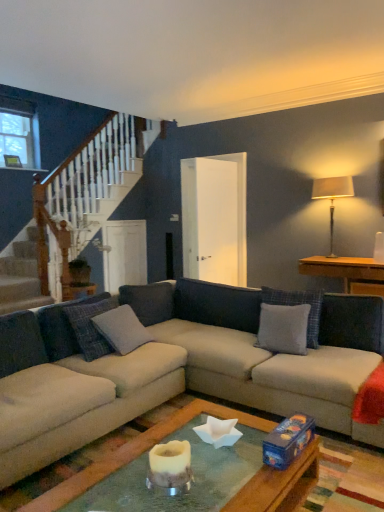
What is the approximate height of wooden side table at right?

16.51 inches.

How much space does gray fabric pillow at center, which ranks as the first pillow in left-to-right order, occupy horizontally?

gray fabric pillow at center, which ranks as the first pillow in left-to-right order, is 5.11 inches in width.

I want to click on clear glass window at upper left, so click(19, 134).

Image resolution: width=384 pixels, height=512 pixels. Describe the element at coordinates (19, 134) in the screenshot. I see `clear glass window at upper left` at that location.

What do you see at coordinates (149, 301) in the screenshot?
I see `gray fabric pillow at center, which is counted as the 2th pillow, starting from the left` at bounding box center [149, 301].

This screenshot has height=512, width=384. Find the location of `gray fabric pillow at center, which is counted as the 2th pillow, starting from the left`. gray fabric pillow at center, which is counted as the 2th pillow, starting from the left is located at coordinates (149, 301).

At what (x,y) coordinates should I click in order to perform the action: click on beige fabric couch at center. Please return your answer as a coordinate pair (x, y). This screenshot has height=512, width=384. Looking at the image, I should click on (177, 370).

The width and height of the screenshot is (384, 512). Find the location of `wooden side table at right`. wooden side table at right is located at coordinates (347, 272).

Is clear glass window at upper left facing towards gray fabric pillow at center, which is counted as the 2th pillow, starting from the left?

Yes, clear glass window at upper left is turned towards gray fabric pillow at center, which is counted as the 2th pillow, starting from the left.

In order to click on the 1st pillow in front of the clear glass window at upper left in this screenshot , I will do `click(149, 301)`.

Between clear glass window at upper left and gray fabric pillow at center, the 3th pillow from the right, which one is positioned in front?

gray fabric pillow at center, the 3th pillow from the right, is closer to the camera.

At what (x,y) coordinates should I click in order to perform the action: click on table above the white ceramic candle holder at center (from a real-world perspective). Please return your answer as a coordinate pair (x, y). The height and width of the screenshot is (512, 384). Looking at the image, I should click on (347, 272).

From a real-world perspective, is white ceramic candle holder at center below wooden side table at right?

Yes, from a real-world perspective, white ceramic candle holder at center is under wooden side table at right.

Is gray fabric pillow at center, arranged as the 2th pillow when viewed from the right, at the right side of beige fabric couch at center?

Yes.

From a real-world perspective, is gray fabric pillow at center, arranged as the 2th pillow when viewed from the right, located higher than beige fabric couch at center?

Yes, from a real-world perspective, gray fabric pillow at center, arranged as the 2th pillow when viewed from the right, is above beige fabric couch at center.

In terms of width, does gray fabric pillow at center, the third pillow positioned from the left, look wider or thinner when compared to beige fabric couch at center?

In the image, gray fabric pillow at center, the third pillow positioned from the left, appears to be more narrow than beige fabric couch at center.

Looking at the image, does gray fabric pillow at center, the third pillow positioned from the left, seem bigger or smaller compared to beige fabric couch at center?

gray fabric pillow at center, the third pillow positioned from the left, is smaller than beige fabric couch at center.

Could you tell me if gray fabric pillow at center, which is counted as the 2th pillow, starting from the left, is turned towards wooden side table at right?

No, gray fabric pillow at center, which is counted as the 2th pillow, starting from the left, is not aimed at wooden side table at right.

Is gray fabric pillow at center, which is counted as the 2th pillow, starting from the left, bigger or smaller than wooden side table at right?

Clearly, gray fabric pillow at center, which is counted as the 2th pillow, starting from the left, is smaller in size than wooden side table at right.

Is point (150, 321) farther from camera compared to point (322, 264)?

That is False.

Considering their positions, is gray fabric pillow at center, the 3th pillow from the right, located in front of or behind wooden side table at right?

gray fabric pillow at center, the 3th pillow from the right, is in front of wooden side table at right.

Which object is further away from the camera, silky beige lampshade at upper right or beige fabric couch at center?

silky beige lampshade at upper right.

Is there a large distance between silky beige lampshade at upper right and beige fabric couch at center?

Absolutely, silky beige lampshade at upper right is distant from beige fabric couch at center.

Based on the photo, in the image, is silky beige lampshade at upper right on the left side or the right side of beige fabric couch at center?

In the image, silky beige lampshade at upper right appears on the right side of beige fabric couch at center.

Could you tell me if gray fabric pillow at center, the 3th pillow from the right, is facing beige fabric couch at center?

Yes.

Is gray fabric pillow at center, the 3th pillow from the right, thinner than beige fabric couch at center?

Yes, gray fabric pillow at center, the 3th pillow from the right, is thinner than beige fabric couch at center.

Is gray fabric pillow at center, the 3th pillow from the right, surrounding beige fabric couch at center?

No, beige fabric couch at center is located outside of gray fabric pillow at center, the 3th pillow from the right.

From the image's perspective, is gray fabric pillow at center, the 3th pillow from the right, above beige fabric couch at center?

Correct, gray fabric pillow at center, the 3th pillow from the right, appears higher than beige fabric couch at center in the image.

From a real-world perspective, is silky beige lampshade at upper right physically located above or below wooden side table at right?

silky beige lampshade at upper right is above wooden side table at right.

This screenshot has height=512, width=384. I want to click on lamp located on the left of wooden side table at right, so click(332, 196).

Is point (339, 185) positioned in front of point (316, 275)?

No, it is not.

This screenshot has height=512, width=384. I want to click on the 1st pillow positioned below the clear glass window at upper left (from a real-world perspective), so click(149, 301).

Identify the location of candle holder located below the wooden side table at right (from the image's perspective). (170, 467).

Considering their positions, is gray fabric pillow at center, arranged as the 2th pillow when viewed from the right, positioned closer to beige fabric couch at center than silky beige lampshade at upper right?

Among the two, gray fabric pillow at center, arranged as the 2th pillow when viewed from the right, is located nearer to beige fabric couch at center.

Looking at the image, which one is located further to beige fabric couch at center, gray fabric pillow at center, the 3th pillow from the right, or silky beige lampshade at upper right?

Based on the image, silky beige lampshade at upper right appears to be further to beige fabric couch at center.

Based on their spatial positions, is beige fabric couch at center or gray fabric pillow at center, which ranks as the first pillow in left-to-right order, further from gray fabric pillow at center, which is counted as the 2th pillow, starting from the left?

beige fabric couch at center.

When comparing their distances from gray fabric pillow at center, the third pillow positioned from the left, does gray fabric pillow at center, acting as the 4th pillow starting from the right, or beige fabric couch at center seem further?

The object further to gray fabric pillow at center, the third pillow positioned from the left, is gray fabric pillow at center, acting as the 4th pillow starting from the right.

When comparing their distances from gray fabric pillow at center, the 1th pillow positioned from the right, does clear glass window at upper left or gray fabric pillow at center, acting as the 4th pillow starting from the right, seem further?

clear glass window at upper left is positioned further to the anchor gray fabric pillow at center, the 1th pillow positioned from the right.

Considering their positions, is clear glass window at upper left positioned further to gray fabric pillow at center, the 1th pillow positioned from the right, than silky beige lampshade at upper right?

clear glass window at upper left is further to gray fabric pillow at center, the 1th pillow positioned from the right.

Based on their spatial positions, is silky beige lampshade at upper right or gray fabric pillow at center, the third pillow positioned from the left, closer to white ceramic candle holder at center?

gray fabric pillow at center, the third pillow positioned from the left, is positioned closer to the anchor white ceramic candle holder at center.

When comparing their distances from silky beige lampshade at upper right, does white ceramic candle holder at center or beige fabric couch at center seem closer?

Among the two, beige fabric couch at center is located nearer to silky beige lampshade at upper right.

At what (x,y) coordinates should I click in order to perform the action: click on lamp located between clear glass window at upper left and wooden side table at right in the left-right direction. Please return your answer as a coordinate pair (x, y). The width and height of the screenshot is (384, 512). Looking at the image, I should click on (332, 196).

Locate an element on the screen. lamp between gray fabric pillow at center, which is counted as the 2th pillow, starting from the left, and wooden side table at right from left to right is located at coordinates tap(332, 196).

Where is `lamp situated between gray fabric pillow at center, which ranks as the first pillow in left-to-right order, and wooden side table at right from left to right`? lamp situated between gray fabric pillow at center, which ranks as the first pillow in left-to-right order, and wooden side table at right from left to right is located at coordinates (332, 196).

Find the location of a particular element. Image resolution: width=384 pixels, height=512 pixels. table between gray fabric pillow at center, the fourth pillow in the left-to-right sequence, and silky beige lampshade at upper right in the front-back direction is located at coordinates (347, 272).